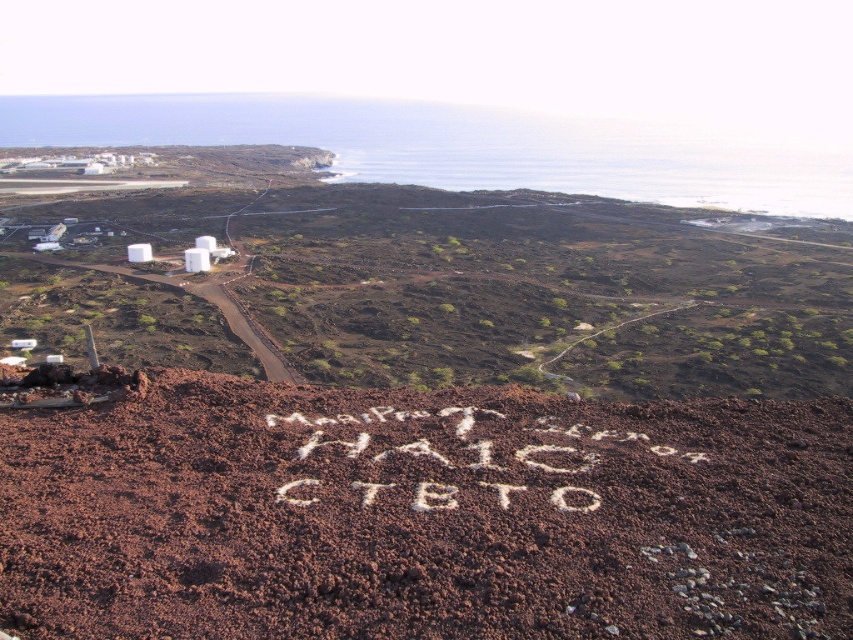
You are a geologist examining the image. You notice the brown dirt at center and the white sand at center. Which material is higher in elevation compared to the other?

The brown dirt at center is much taller than the white sand at center, so the brown dirt at center has a higher elevation.

You are a geologist examining the terrain. You notice two materials at the center of the image. Which one is bigger in size between the brown dirt at center and the white sand at center?

The brown dirt at center has a larger size compared to the white sand at center.